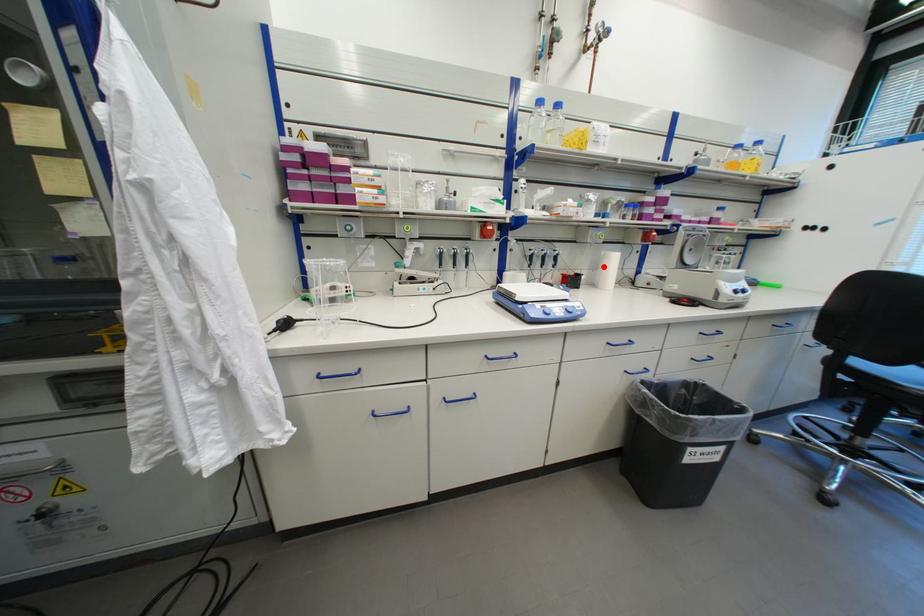
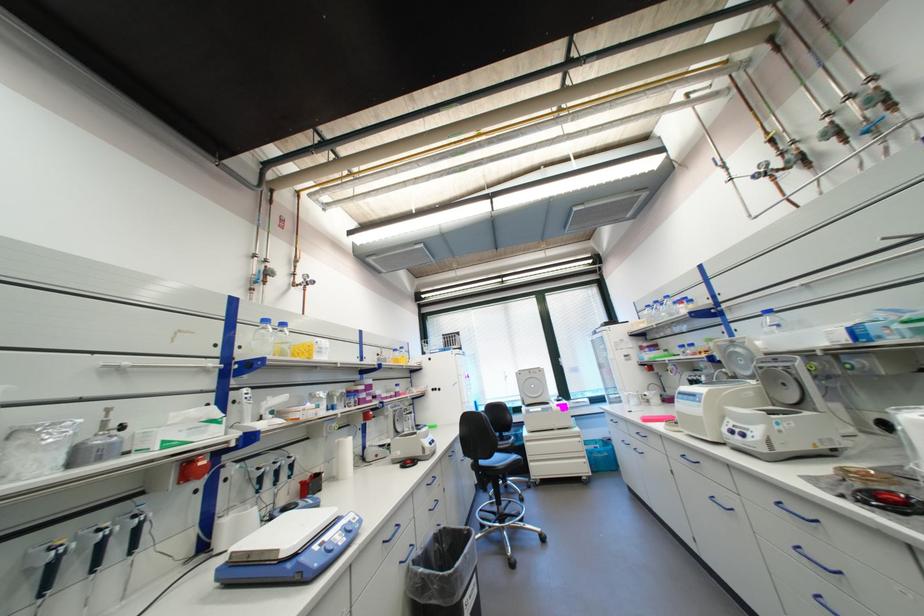
In the second image, find the point that corresponds to the highlighted location in the first image.

(339, 458)